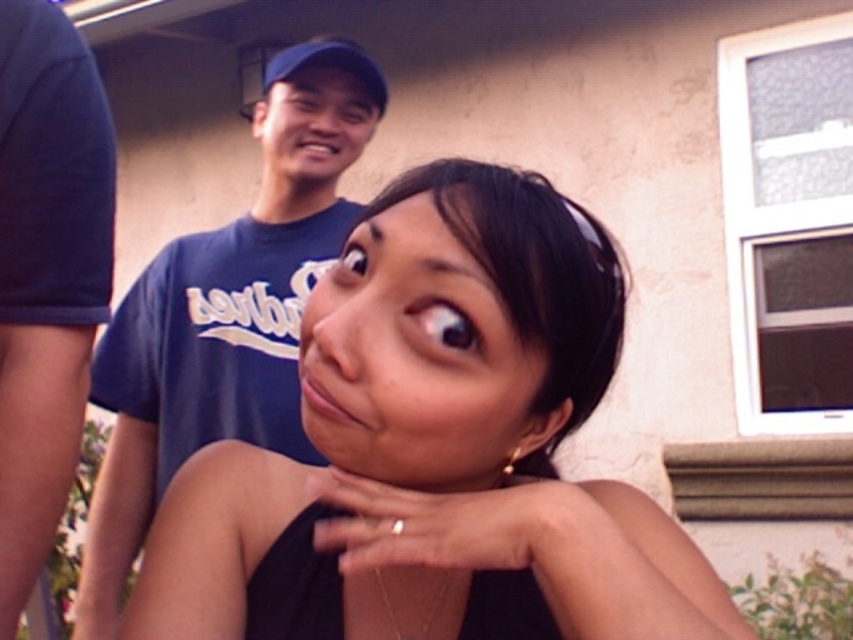
You are a photographer trying to capture a closeup shot of the smooth skin face at center while ensuring the matte black tank top at center is still visible in the frame. Based on their sizes, will you need to adjust your camera to focus more on the face or the tank top?

The matte black tank top at center is bigger than the smooth skin face at center, so you should focus more on the face to ensure both are visible in the frame.

You are a photographer trying to capture a portrait of the smooth skin face at center and the dark blue fabric at center in the image. Based on their positions, which object should you focus on first to ensure both are in frame?

The dark blue fabric at center is to the left of the smooth skin face at center, so you should focus on the smooth skin face at center first to ensure both are in frame.